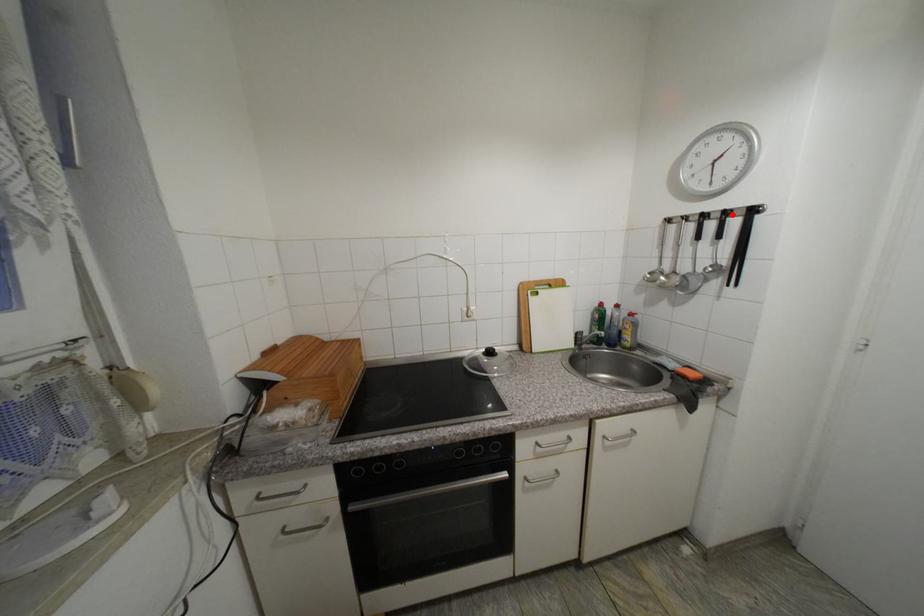
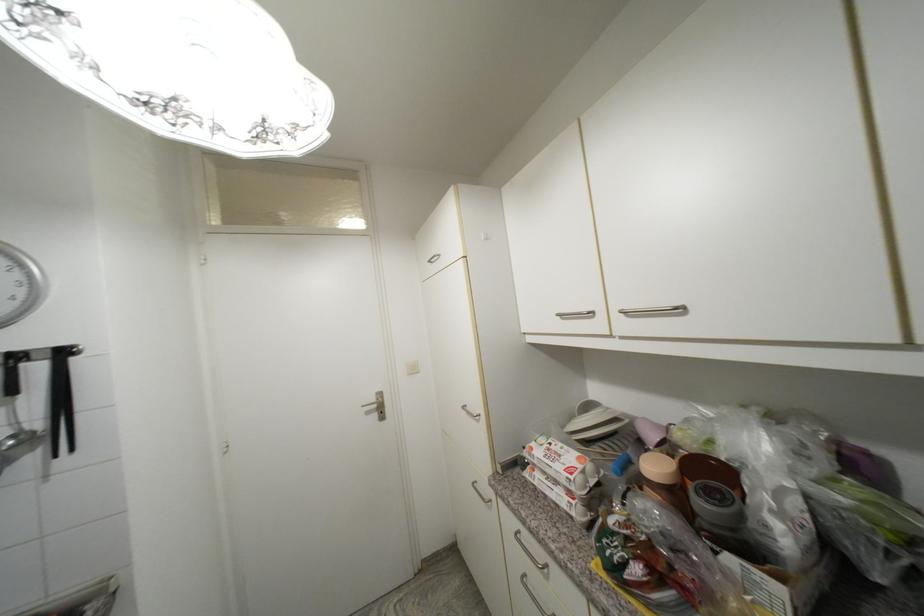
Locate, in the second image, the point that corresponds to the highlighted location in the first image.

(22, 359)